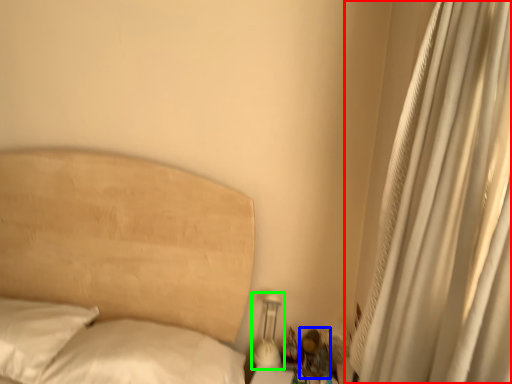
Question: Which object is positioned closest to curtain (highlighted by a red box)? Select from miniature (highlighted by a blue box) and bedside lamp (highlighted by a green box).

Choices:
 (A) miniature
 (B) bedside lamp

Answer: (A)